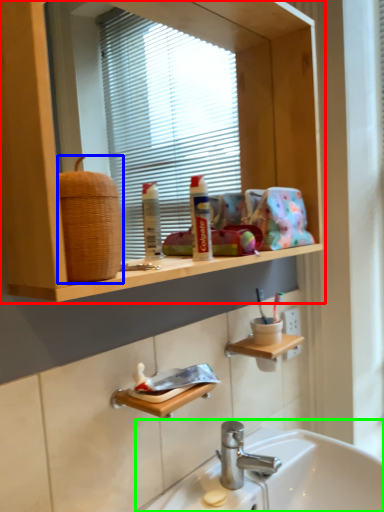
Question: Which is farther away from bathroom cabinet (highlighted by a red box)? basket (highlighted by a blue box) or sink (highlighted by a green box)?

Choices:
 (A) basket
 (B) sink

Answer: (B)